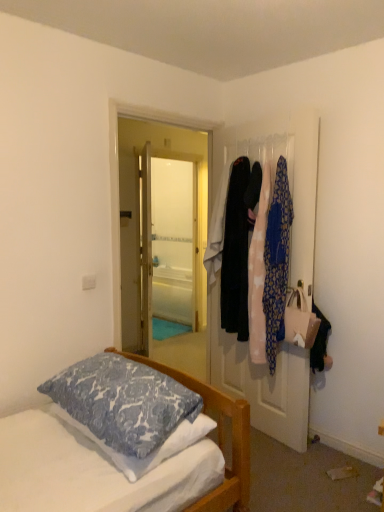
I want to click on patterned fabric clothesline at upper right, so click(x=261, y=149).

What do you see at coordinates (258, 274) in the screenshot? This screenshot has height=512, width=384. I see `light pink fabric dress at right, the 2th clothing when ordered from right to left` at bounding box center [258, 274].

This screenshot has height=512, width=384. What do you see at coordinates (236, 253) in the screenshot?
I see `black velvet coat at right, which ranks as the 3th clothing in right-to-left order` at bounding box center [236, 253].

Image resolution: width=384 pixels, height=512 pixels. What do you see at coordinates (123, 402) in the screenshot?
I see `blue printed pillow at lower left` at bounding box center [123, 402].

The height and width of the screenshot is (512, 384). What are the coordinates of `blue printed pillow at lower left` in the screenshot? It's located at (123, 402).

Find the location of a particular element. The width and height of the screenshot is (384, 512). patterned fabric clothesline at upper right is located at coordinates tap(261, 149).

From the image's perspective, which is above, blue printed pillow at lower left or patterned fabric clothesline at upper right?

patterned fabric clothesline at upper right, from the image's perspective.

Between blue printed pillow at lower left and patterned fabric clothesline at upper right, which one is positioned behind?

patterned fabric clothesline at upper right is further away from the camera.

Is blue printed pillow at lower left turned away from patterned fabric clothesline at upper right?

blue printed pillow at lower left does not have its back to patterned fabric clothesline at upper right.

Would you say blue printed pillow at lower left is inside or outside patterned fabric clothesline at upper right?

blue printed pillow at lower left is not enclosed by patterned fabric clothesline at upper right.

Considering the relative sizes of black velvet coat at right, the first clothing in the left-to-right sequence, and blue printed pillow at lower left in the image provided, is black velvet coat at right, the first clothing in the left-to-right sequence, wider than blue printed pillow at lower left?

Incorrect, the width of black velvet coat at right, the first clothing in the left-to-right sequence, does not surpass that of blue printed pillow at lower left.

From a real-world perspective, is black velvet coat at right, the first clothing in the left-to-right sequence, physically located above or below blue printed pillow at lower left?

black velvet coat at right, the first clothing in the left-to-right sequence, is above blue printed pillow at lower left.

Considering the sizes of objects black velvet coat at right, the first clothing in the left-to-right sequence, and blue printed pillow at lower left in the image provided, who is taller, black velvet coat at right, the first clothing in the left-to-right sequence, or blue printed pillow at lower left?

black velvet coat at right, the first clothing in the left-to-right sequence.

Is black velvet coat at right, the first clothing in the left-to-right sequence, at the right side of blue printed pillow at lower left?

Correct, you'll find black velvet coat at right, the first clothing in the left-to-right sequence, to the right of blue printed pillow at lower left.

Consider the image. Is black velvet coat at right, the first clothing in the left-to-right sequence, to the left or to the right of blue patterned fabric at right, arranged as the 1th clothing when viewed from the right, in the image?

black velvet coat at right, the first clothing in the left-to-right sequence, is positioned on blue patterned fabric at right, arranged as the 1th clothing when viewed from the right,'s left side.

Is black velvet coat at right, which ranks as the 3th clothing in right-to-left order, taller or shorter than blue patterned fabric at right, positioned as the 3th clothing in left-to-right order?

Considering their sizes, black velvet coat at right, which ranks as the 3th clothing in right-to-left order, has less height than blue patterned fabric at right, positioned as the 3th clothing in left-to-right order.

Would you consider black velvet coat at right, which ranks as the 3th clothing in right-to-left order, to be distant from blue patterned fabric at right, positioned as the 3th clothing in left-to-right order?

black velvet coat at right, which ranks as the 3th clothing in right-to-left order, is near blue patterned fabric at right, positioned as the 3th clothing in left-to-right order, not far away.

How many degrees apart are the facing directions of blue printed pillow at lower left and white glossy door at center?

The angle between the facing direction of blue printed pillow at lower left and the facing direction of white glossy door at center is 7.26 degrees.

From a real-world perspective, relative to white glossy door at center, is blue printed pillow at lower left vertically above or below?

Clearly, from a real-world perspective, blue printed pillow at lower left is below white glossy door at center.

Can you see blue printed pillow at lower left touching white glossy door at center?

They are not placed beside each other.

How many degrees apart are the facing directions of light pink fabric dress at right, the 2th clothing when ordered from right to left, and black velvet coat at right, which ranks as the 3th clothing in right-to-left order?

light pink fabric dress at right, the 2th clothing when ordered from right to left, and black velvet coat at right, which ranks as the 3th clothing in right-to-left order, are facing 0.464 degrees away from each other.

Is light pink fabric dress at right, the 2th clothing when ordered from right to left, touching black velvet coat at right, the first clothing in the left-to-right sequence?

light pink fabric dress at right, the 2th clothing when ordered from right to left, is not next to black velvet coat at right, the first clothing in the left-to-right sequence, and they're not touching.

Which is behind, point (255, 333) or point (243, 308)?

The point (243, 308) is farther from the camera.

Is black velvet coat at right, which ranks as the 3th clothing in right-to-left order, located within light pink fabric dress at right, the 2th clothing when ordered from right to left?

Actually, black velvet coat at right, which ranks as the 3th clothing in right-to-left order, is outside light pink fabric dress at right, the 2th clothing when ordered from right to left.

Is light pink fabric dress at right, the 2th clothing in the left-to-right sequence, next to blue patterned fabric at right, positioned as the 3th clothing in left-to-right order?

Indeed, light pink fabric dress at right, the 2th clothing in the left-to-right sequence, and blue patterned fabric at right, positioned as the 3th clothing in left-to-right order, are beside each other and touching.

Which object is thinner, light pink fabric dress at right, the 2th clothing when ordered from right to left, or blue patterned fabric at right, positioned as the 3th clothing in left-to-right order?

blue patterned fabric at right, positioned as the 3th clothing in left-to-right order.

Does light pink fabric dress at right, the 2th clothing when ordered from right to left, have a smaller size compared to blue patterned fabric at right, positioned as the 3th clothing in left-to-right order?

Yes, light pink fabric dress at right, the 2th clothing when ordered from right to left, is smaller than blue patterned fabric at right, positioned as the 3th clothing in left-to-right order.

From the image's perspective, is light pink fabric dress at right, the 2th clothing in the left-to-right sequence, above blue patterned fabric at right, positioned as the 3th clothing in left-to-right order?

Yes, from the image's perspective, light pink fabric dress at right, the 2th clothing in the left-to-right sequence, is on top of blue patterned fabric at right, positioned as the 3th clothing in left-to-right order.

Would you consider light pink fabric dress at right, the 2th clothing in the left-to-right sequence, to be distant from patterned fabric clothesline at upper right?

No, light pink fabric dress at right, the 2th clothing in the left-to-right sequence, is not far away from patterned fabric clothesline at upper right.

Identify the location of the 1st clothing to the right when counting from the patterned fabric clothesline at upper right. (258, 274).

From a real-world perspective, does light pink fabric dress at right, the 2th clothing in the left-to-right sequence, stand above patterned fabric clothesline at upper right?

No.

This screenshot has width=384, height=512. In order to click on clothesline located behind the blue printed pillow at lower left in this screenshot , I will do `click(261, 149)`.

There is a blue printed pillow at lower left. Where is `the 3rd clothing above it (from a real-world perspective)`? This screenshot has width=384, height=512. the 3rd clothing above it (from a real-world perspective) is located at coordinates pyautogui.click(x=236, y=253).

Estimate the real-world distances between objects in this image. Which object is closer to light pink fabric dress at right, the 2th clothing in the left-to-right sequence, black velvet coat at right, which ranks as the 3th clothing in right-to-left order, or blue printed pillow at lower left?

Based on the image, black velvet coat at right, which ranks as the 3th clothing in right-to-left order, appears to be nearer to light pink fabric dress at right, the 2th clothing in the left-to-right sequence.

When comparing their distances from patterned fabric clothesline at upper right, does white glossy door at center or light pink fabric dress at right, the 2th clothing in the left-to-right sequence, seem closer?

light pink fabric dress at right, the 2th clothing in the left-to-right sequence, is closer to patterned fabric clothesline at upper right.

From the image, which object appears to be nearer to blue printed pillow at lower left, blue patterned fabric at right, arranged as the 1th clothing when viewed from the right, or light pink fabric dress at right, the 2th clothing in the left-to-right sequence?

light pink fabric dress at right, the 2th clothing in the left-to-right sequence, is positioned closer to the anchor blue printed pillow at lower left.

Consider the image. When comparing their distances from light pink fabric dress at right, the 2th clothing in the left-to-right sequence, does patterned fabric clothesline at upper right or blue patterned fabric at right, positioned as the 3th clothing in left-to-right order, seem closer?

Among the two, blue patterned fabric at right, positioned as the 3th clothing in left-to-right order, is located nearer to light pink fabric dress at right, the 2th clothing in the left-to-right sequence.

Looking at the image, which one is located further to patterned fabric clothesline at upper right, blue printed pillow at lower left or white glossy door at center?

blue printed pillow at lower left lies further to patterned fabric clothesline at upper right than the other object.

Which object lies nearer to the anchor point patterned fabric clothesline at upper right, light pink fabric dress at right, the 2th clothing when ordered from right to left, or blue printed pillow at lower left?

light pink fabric dress at right, the 2th clothing when ordered from right to left, is closer to patterned fabric clothesline at upper right.

From the image, which object appears to be farther from blue printed pillow at lower left, white glossy door at center or light pink fabric dress at right, the 2th clothing when ordered from right to left?

white glossy door at center is further to blue printed pillow at lower left.

When comparing their distances from light pink fabric dress at right, the 2th clothing when ordered from right to left, does blue printed pillow at lower left or black velvet coat at right, which ranks as the 3th clothing in right-to-left order, seem further?

The object further to light pink fabric dress at right, the 2th clothing when ordered from right to left, is blue printed pillow at lower left.

This screenshot has width=384, height=512. Identify the location of door that lies between patterned fabric clothesline at upper right and blue printed pillow at lower left from top to bottom. (260, 380).

Find the location of a particular element. door between blue printed pillow at lower left and black velvet coat at right, which ranks as the 3th clothing in right-to-left order, in the front-back direction is located at coordinates (260, 380).

Where is `door located between blue printed pillow at lower left and light pink fabric dress at right, the 2th clothing in the left-to-right sequence, in the depth direction`? The image size is (384, 512). door located between blue printed pillow at lower left and light pink fabric dress at right, the 2th clothing in the left-to-right sequence, in the depth direction is located at coordinates (260, 380).

I want to click on clothing between white glossy door at center and light pink fabric dress at right, the 2th clothing in the left-to-right sequence, from front to back, so click(x=277, y=262).